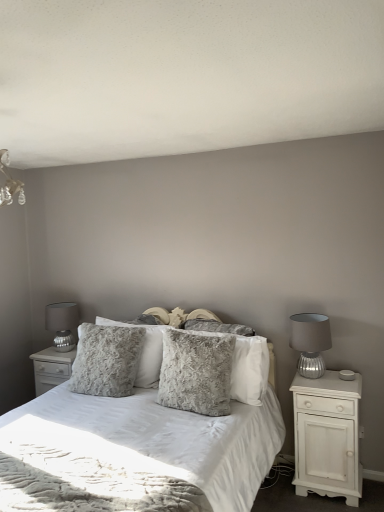
What is the approximate height of fluffy gray pillow at center, the 1th pillow when ordered from back to front?

fluffy gray pillow at center, the 1th pillow when ordered from back to front, is 23.56 inches tall.

This screenshot has width=384, height=512. What do you see at coordinates (51, 368) in the screenshot?
I see `white textured nightstand at center, which ranks as the 2th nightstand in front-to-back order` at bounding box center [51, 368].

What do you see at coordinates (327, 436) in the screenshot? This screenshot has width=384, height=512. I see `white wood nightstand at right, the 1th nightstand in the front-to-back sequence` at bounding box center [327, 436].

What is the approximate width of matte silver table lamp at left, the 1th table lamp when ordered from back to front?

The width of matte silver table lamp at left, the 1th table lamp when ordered from back to front, is 12.30 inches.

In order to click on fuzzy gray pillow at center, acting as the 2th pillow starting from the back in this screenshot , I will do `click(250, 370)`.

Is white textured nightstand at center, which is the 1th nightstand from left to right, positioned with its back to white wood nightstand at right, arranged as the 2th nightstand when viewed from the left?

white textured nightstand at center, which is the 1th nightstand from left to right, is not turned away from white wood nightstand at right, arranged as the 2th nightstand when viewed from the left.

Can you confirm if white textured nightstand at center, which is the 2th nightstand in right-to-left order, is positioned to the left of white wood nightstand at right, arranged as the 2th nightstand when viewed from the left?

Yes, white textured nightstand at center, which is the 2th nightstand in right-to-left order, is to the left of white wood nightstand at right, arranged as the 2th nightstand when viewed from the left.

Is white textured nightstand at center, which ranks as the 2th nightstand in front-to-back order, surrounding white wood nightstand at right, marked as the 1th nightstand in a right-to-left arrangement?

No, white wood nightstand at right, marked as the 1th nightstand in a right-to-left arrangement, is not inside white textured nightstand at center, which ranks as the 2th nightstand in front-to-back order.

Does matte silver table lamp at left, the 1th table lamp when ordered from back to front, appear on the right side of matte silver lamp at right, which is the second table lamp in back-to-front order?

Incorrect, matte silver table lamp at left, the 1th table lamp when ordered from back to front, is not on the right side of matte silver lamp at right, which is the second table lamp in back-to-front order.

This screenshot has width=384, height=512. Identify the location of table lamp located above the matte silver lamp at right, the 1th table lamp positioned from the front (from a real-world perspective). (62, 324).

Is matte silver table lamp at left, the 1th table lamp when ordered from back to front, beside matte silver lamp at right, which appears as the 1th table lamp when viewed from the right?

No, matte silver table lamp at left, the 1th table lamp when ordered from back to front, is not making contact with matte silver lamp at right, which appears as the 1th table lamp when viewed from the right.

Which of these two, matte silver table lamp at left, which ranks as the 2th table lamp in right-to-left order, or matte silver lamp at right, arranged as the 2th table lamp when viewed from the left, stands taller?

matte silver table lamp at left, which ranks as the 2th table lamp in right-to-left order.

Locate an element on the screen. This screenshot has width=384, height=512. the 1st nightstand below the matte silver table lamp at left, the 1th table lamp when ordered from back to front (from the image's perspective) is located at coordinates (51, 368).

Does white textured nightstand at center, which is the 1th nightstand from left to right, turn towards matte silver table lamp at left, which ranks as the 2th table lamp in right-to-left order?

No, white textured nightstand at center, which is the 1th nightstand from left to right, is not turned towards matte silver table lamp at left, which ranks as the 2th table lamp in right-to-left order.

Is white textured nightstand at center, which is the 2th nightstand in right-to-left order, placed right next to matte silver table lamp at left, which ranks as the 2th table lamp in front-to-back order?

No, white textured nightstand at center, which is the 2th nightstand in right-to-left order, is not beside matte silver table lamp at left, which ranks as the 2th table lamp in front-to-back order.

Considering the sizes of objects white textured nightstand at center, which is the 2th nightstand in right-to-left order, and matte silver table lamp at left, the 1th table lamp when ordered from back to front, in the image provided, who is shorter, white textured nightstand at center, which is the 2th nightstand in right-to-left order, or matte silver table lamp at left, the 1th table lamp when ordered from back to front,?

matte silver table lamp at left, the 1th table lamp when ordered from back to front, is shorter.

Between matte silver table lamp at left, the 1th table lamp when ordered from back to front, and white textured nightstand at center, which ranks as the 2th nightstand in front-to-back order, which one has less height?

Standing shorter between the two is matte silver table lamp at left, the 1th table lamp when ordered from back to front.

From the image's perspective, is matte silver table lamp at left, which is counted as the 1th table lamp, starting from the left, on top of white textured nightstand at center, the 1th nightstand viewed from the back?

Yes, from the image's perspective, matte silver table lamp at left, which is counted as the 1th table lamp, starting from the left, is above white textured nightstand at center, the 1th nightstand viewed from the back.

Which nightstand is the 1st one when counting from the right side of the matte silver table lamp at left, which ranks as the 2th table lamp in front-to-back order? Please provide its 2D coordinates.

[(51, 368)]

From a real-world perspective, is matte silver table lamp at left, which ranks as the 2th table lamp in right-to-left order, located beneath white textured nightstand at center, which ranks as the 2th nightstand in front-to-back order?

No, from a real-world perspective, matte silver table lamp at left, which ranks as the 2th table lamp in right-to-left order, is not below white textured nightstand at center, which ranks as the 2th nightstand in front-to-back order.

Is matte silver table lamp at left, which is counted as the 1th table lamp, starting from the left, beside fuzzy fabric bed at center?

No, matte silver table lamp at left, which is counted as the 1th table lamp, starting from the left, is not making contact with fuzzy fabric bed at center.

How far apart are matte silver table lamp at left, which ranks as the 2th table lamp in front-to-back order, and fuzzy fabric bed at center?

matte silver table lamp at left, which ranks as the 2th table lamp in front-to-back order, is 1.35 meters away from fuzzy fabric bed at center.

Can fuzzy fabric bed at center be found inside matte silver table lamp at left, which is counted as the 1th table lamp, starting from the left?

That's incorrect, fuzzy fabric bed at center is not inside matte silver table lamp at left, which is counted as the 1th table lamp, starting from the left.

Is matte silver table lamp at left, the 1th table lamp when ordered from back to front, bigger or smaller than fuzzy fabric bed at center?

Considering their sizes, matte silver table lamp at left, the 1th table lamp when ordered from back to front, takes up less space than fuzzy fabric bed at center.

There is a white wood nightstand at right, marked as the 1th nightstand in a right-to-left arrangement. Identify the location of the 2nd pillow above it (from the image's perspective). Image resolution: width=384 pixels, height=512 pixels. (250, 370).

From a real-world perspective, is white wood nightstand at right, which ranks as the 2th nightstand in back-to-front order, positioned under fuzzy gray pillow at center, marked as the second pillow in a front-to-back arrangement, based on gravity?

Indeed, from a real-world perspective, white wood nightstand at right, which ranks as the 2th nightstand in back-to-front order, is positioned beneath fuzzy gray pillow at center, marked as the second pillow in a front-to-back arrangement.

Which is in front, white wood nightstand at right, the 1th nightstand in the front-to-back sequence, or fuzzy gray pillow at center, acting as the 2th pillow starting from the back?

Positioned in front is white wood nightstand at right, the 1th nightstand in the front-to-back sequence.

In the scene shown: Could you measure the distance between fluffy gray pillow at center, which is the 3th pillow from front to back, and matte silver table lamp at left, the 1th table lamp when ordered from back to front?

fluffy gray pillow at center, which is the 3th pillow from front to back, and matte silver table lamp at left, the 1th table lamp when ordered from back to front, are 30.29 inches apart from each other.

Considering the sizes of objects fluffy gray pillow at center, the 1th pillow when ordered from back to front, and matte silver table lamp at left, which ranks as the 2th table lamp in right-to-left order, in the image provided, who is thinner, fluffy gray pillow at center, the 1th pillow when ordered from back to front, or matte silver table lamp at left, which ranks as the 2th table lamp in right-to-left order,?

fluffy gray pillow at center, the 1th pillow when ordered from back to front.

Who is bigger, fluffy gray pillow at center, which is the 3th pillow from front to back, or matte silver table lamp at left, which ranks as the 2th table lamp in right-to-left order?

fluffy gray pillow at center, which is the 3th pillow from front to back, is bigger.

I want to click on nightstand above the white wood nightstand at right, marked as the 1th nightstand in a right-to-left arrangement (from a real-world perspective), so click(51, 368).

At what (x,y) coordinates should I click in order to perform the action: click on table lamp that is behind the matte silver lamp at right, which is the second table lamp in back-to-front order. Please return your answer as a coordinate pair (x, y). Looking at the image, I should click on (62, 324).

Estimate the real-world distances between objects in this image. Which object is further from fuzzy fabric bed at center, white textured nightstand at center, the 1th nightstand viewed from the back, or fuzzy gray pillow at center, marked as the second pillow in a front-to-back arrangement?

The object further to fuzzy fabric bed at center is white textured nightstand at center, the 1th nightstand viewed from the back.

Estimate the real-world distances between objects in this image. Which object is further from matte silver lamp at right, the 1th table lamp positioned from the front, fuzzy gray pillow at center, acting as the 2th pillow starting from the back, or fuzzy gray pillow at center, the third pillow when ordered from back to front?

fuzzy gray pillow at center, the third pillow when ordered from back to front.

When comparing their distances from matte silver lamp at right, arranged as the 2th table lamp when viewed from the left, does fuzzy gray pillow at center, acting as the 2th pillow starting from the back, or fuzzy fabric bed at center seem closer?

The object closer to matte silver lamp at right, arranged as the 2th table lamp when viewed from the left, is fuzzy gray pillow at center, acting as the 2th pillow starting from the back.

Which object lies further to the anchor point fuzzy gray pillow at center, acting as the 2th pillow starting from the back, white wood nightstand at right, marked as the 1th nightstand in a right-to-left arrangement, or fuzzy fabric bed at center?

white wood nightstand at right, marked as the 1th nightstand in a right-to-left arrangement, is positioned further to the anchor fuzzy gray pillow at center, acting as the 2th pillow starting from the back.

Looking at this image, looking at the image, which one is located further to white textured nightstand at center, the 1th nightstand viewed from the back, fuzzy gray pillow at center, the third pillow when ordered from back to front, or fuzzy gray pillow at center, marked as the second pillow in a front-to-back arrangement?

fuzzy gray pillow at center, marked as the second pillow in a front-to-back arrangement, is positioned further to the anchor white textured nightstand at center, the 1th nightstand viewed from the back.

Looking at the image, which one is located further to matte silver lamp at right, which is the second table lamp in back-to-front order, white textured nightstand at center, which is the 2th nightstand in right-to-left order, or matte silver table lamp at left, the 1th table lamp when ordered from back to front?

matte silver table lamp at left, the 1th table lamp when ordered from back to front, lies further to matte silver lamp at right, which is the second table lamp in back-to-front order, than the other object.

Looking at the image, which one is located further to matte silver lamp at right, the 1th table lamp positioned from the front, matte silver table lamp at left, which is counted as the 1th table lamp, starting from the left, or fuzzy gray pillow at center, marked as the second pillow in a front-to-back arrangement?

matte silver table lamp at left, which is counted as the 1th table lamp, starting from the left, lies further to matte silver lamp at right, the 1th table lamp positioned from the front, than the other object.

Estimate the real-world distances between objects in this image. Which object is closer to fuzzy gray pillow at center, the third pillow when ordered from back to front, fuzzy gray pillow at center, marked as the second pillow in a front-to-back arrangement, or fuzzy fabric bed at center?

fuzzy gray pillow at center, marked as the second pillow in a front-to-back arrangement, is closer to fuzzy gray pillow at center, the third pillow when ordered from back to front.

What are the coordinates of `table lamp between white textured nightstand at center, which is the 1th nightstand from left to right, and white wood nightstand at right, which ranks as the 2th nightstand in back-to-front order, from left to right` in the screenshot? It's located at (310, 342).

I want to click on pillow between fuzzy fabric bed at center and white wood nightstand at right, arranged as the 2th nightstand when viewed from the left, along the z-axis, so [x=196, y=372].

The height and width of the screenshot is (512, 384). In order to click on nightstand located between fuzzy fabric bed at center and white textured nightstand at center, which ranks as the 2th nightstand in front-to-back order, in the depth direction in this screenshot , I will do `click(327, 436)`.

At what (x,y) coordinates should I click in order to perform the action: click on pillow between fuzzy fabric bed at center and fuzzy gray pillow at center, acting as the 2th pillow starting from the back, from front to back. Please return your answer as a coordinate pair (x, y). Looking at the image, I should click on (196, 372).